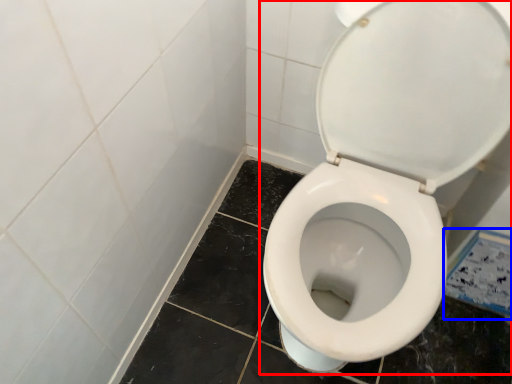
Question: Among these objects, which one is nearest to the camera, toilet (highlighted by a red box) or ceramic tile (highlighted by a blue box)?

Choices:
 (A) toilet
 (B) ceramic tile

Answer: (A)